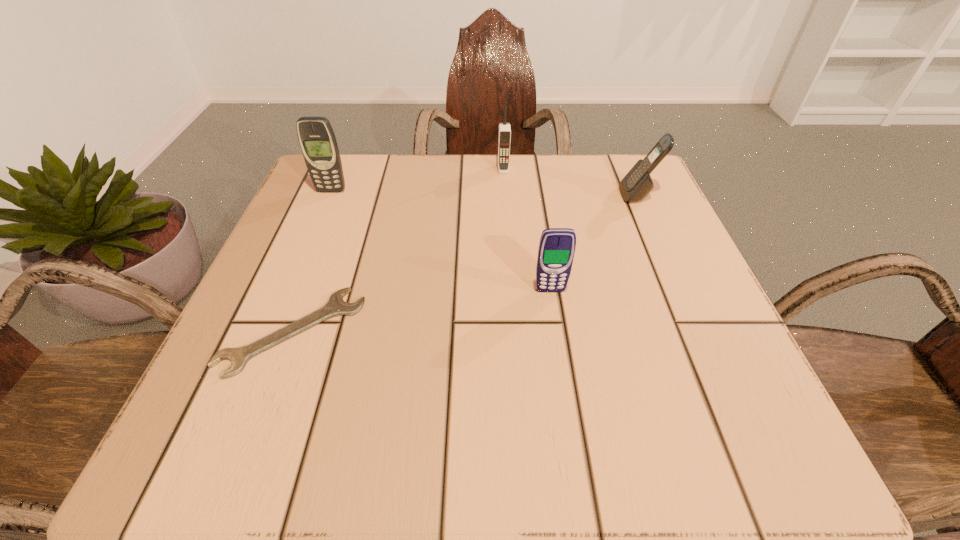
In the image, there is a desktop. At what (x,y) coordinates should I click in order to perform the action: click on vacant area at the near edge. Please return your answer as a coordinate pair (x, y). Looking at the image, I should click on (347, 438).

You are a GUI agent. You are given a task and a screenshot of the screen. Output one action in this format:
    pyautogui.click(x=<x>, y=<y>)
    Task: Click on the vacant space at the left edge
    The width and height of the screenshot is (960, 540).
    Given the screenshot: What is the action you would take?
    pyautogui.click(x=348, y=295)

Find the location of a particular element. The image size is (960, 540). vacant space at the right edge of the desktop is located at coordinates (622, 225).

The height and width of the screenshot is (540, 960). Find the location of `blank area at the far left corner`. blank area at the far left corner is located at coordinates (318, 204).

At what (x,y) coordinates should I click in order to perform the action: click on free space at the far right corner. Please return your answer as a coordinate pair (x, y). The width and height of the screenshot is (960, 540). Looking at the image, I should click on (621, 172).

Identify the location of vacant space at the near right corner of the desktop. The image size is (960, 540). pyautogui.click(x=759, y=427).

Image resolution: width=960 pixels, height=540 pixels. What are the coordinates of `vacant area that lies between the leftmost cellular telephone and the wrench` in the screenshot? It's located at (312, 261).

The image size is (960, 540). Find the location of `unoccupied area between the leftmost cellular telephone and the rightmost cellular telephone`. unoccupied area between the leftmost cellular telephone and the rightmost cellular telephone is located at coordinates (485, 193).

The width and height of the screenshot is (960, 540). I want to click on empty space between the nearest cellular telephone and the rightmost object, so click(594, 243).

Image resolution: width=960 pixels, height=540 pixels. In order to click on vacant space that's between the leftmost cellular telephone and the farthest object in this screenshot , I will do `click(418, 180)`.